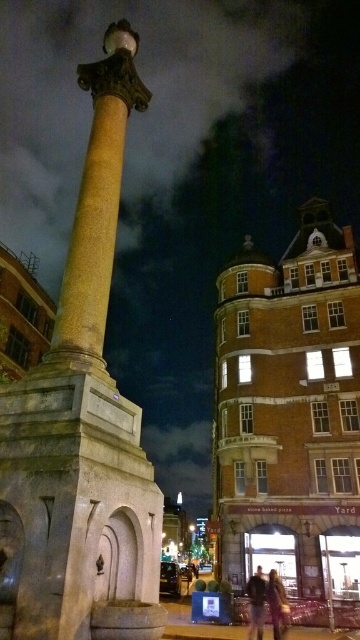
You are a delivery person holding a package that is the same width as the dark brown leather jacket at lower center. You want to slide the package between the marble column at center and a wall to the right. Is there enough space for the package to fit sideways?

The marble column at center is wider than the dark brown leather jacket at lower center. Since the package has the same width as the jacket, the space between the column and the wall might be narrower than the package, making it difficult to fit sideways.

You are standing in the nighttime urban scene and want to pick up both the leather jacket at center and the dark brown leather jacket at lower center. Which jacket should you reach for first to grab the one closer to you?

The leather jacket at center is closer to the viewer than the dark brown leather jacket at lower center, so you should reach for the leather jacket at center first.